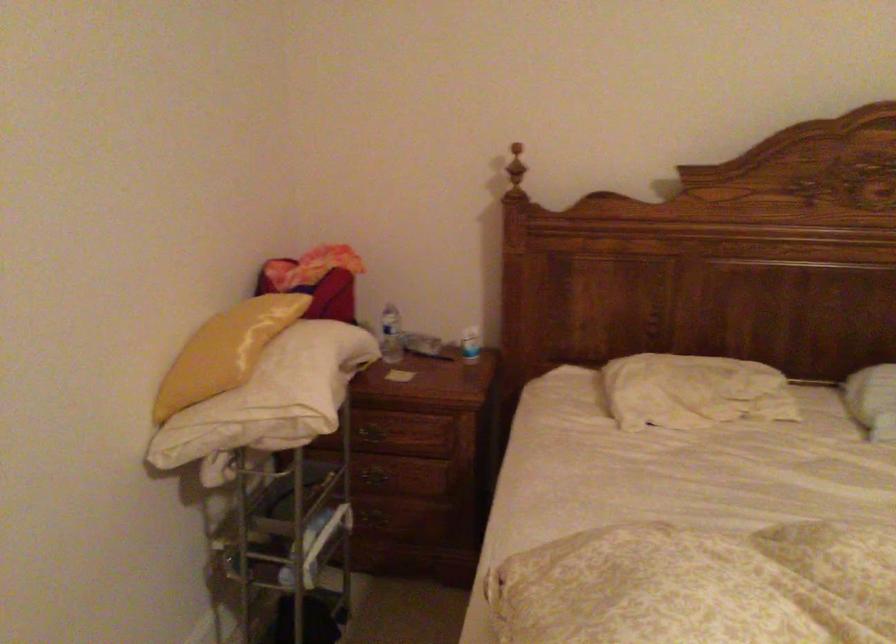
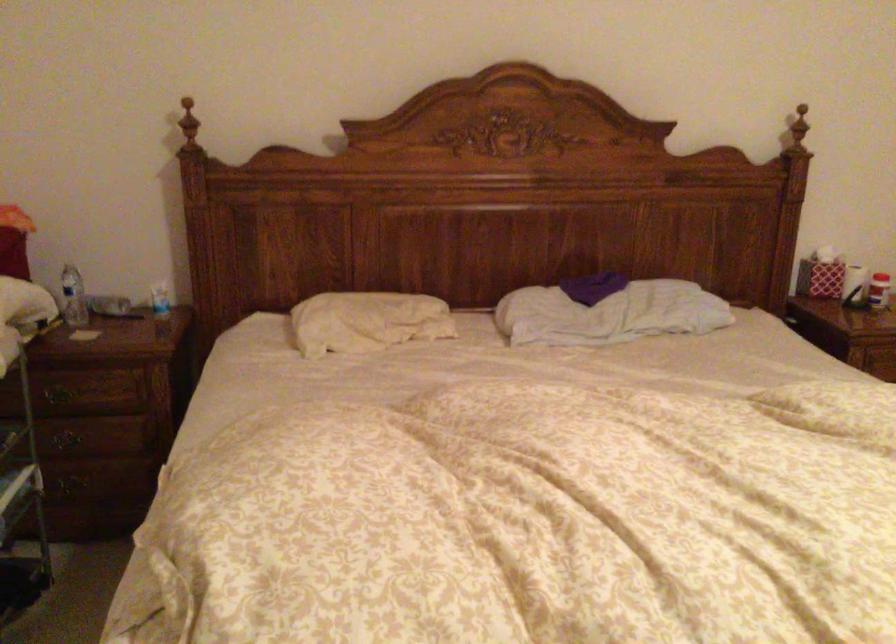
Question: The images are taken continuously from a first-person perspective. In which direction is your viewpoint rotating?

Choices:
 (A) Left
 (B) Right
 (C) Up
 (D) Down

Answer: (B)